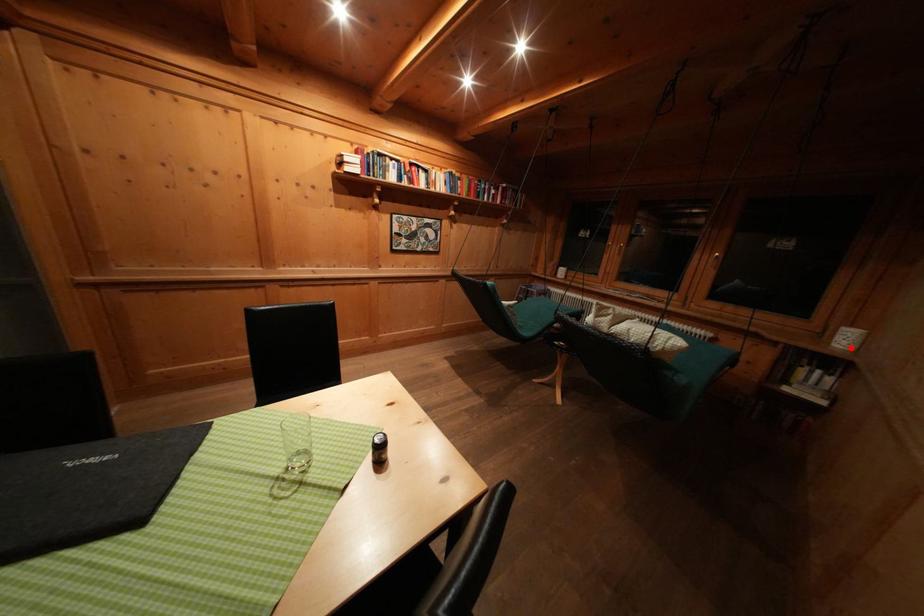
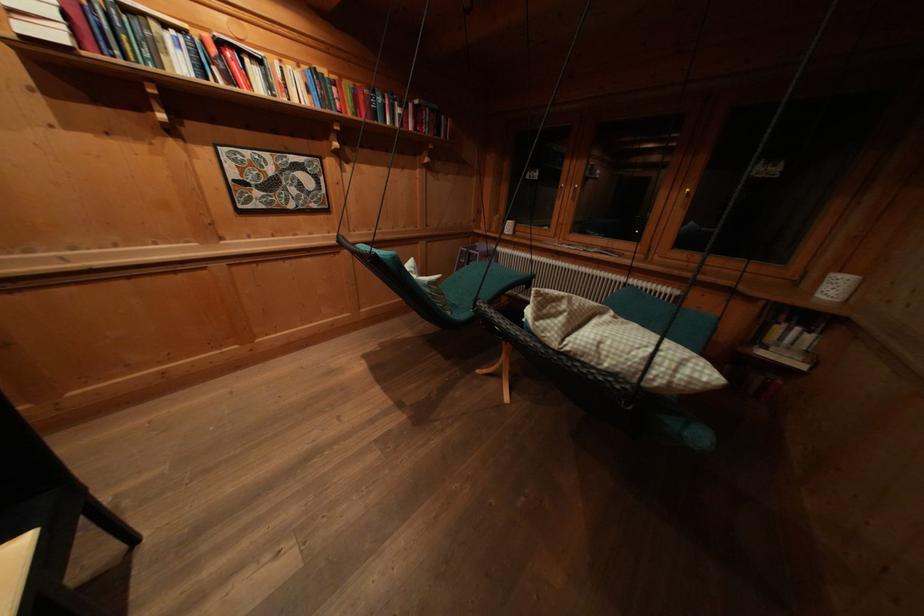
The point at the highlighted location is marked in the first image. Where is the corresponding point in the second image?

(839, 298)